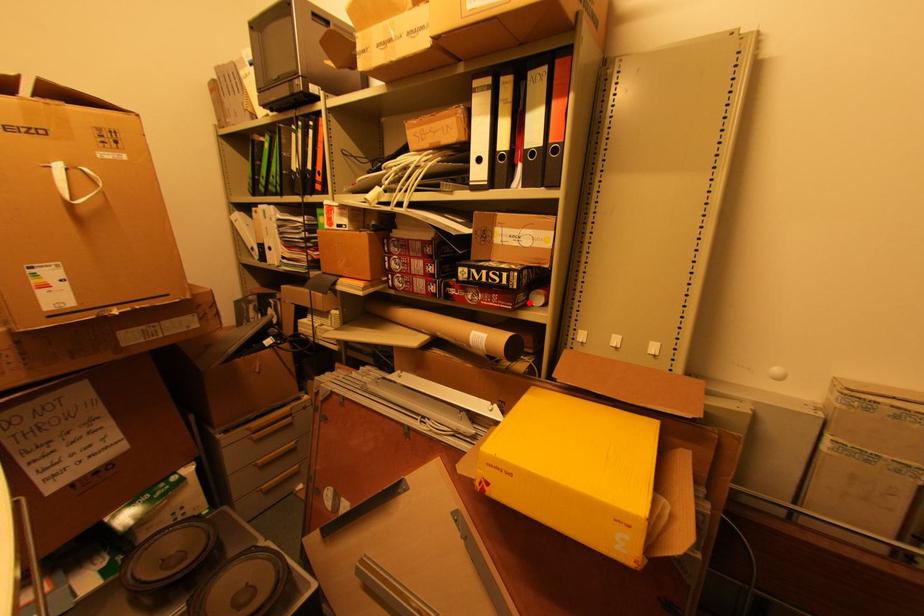
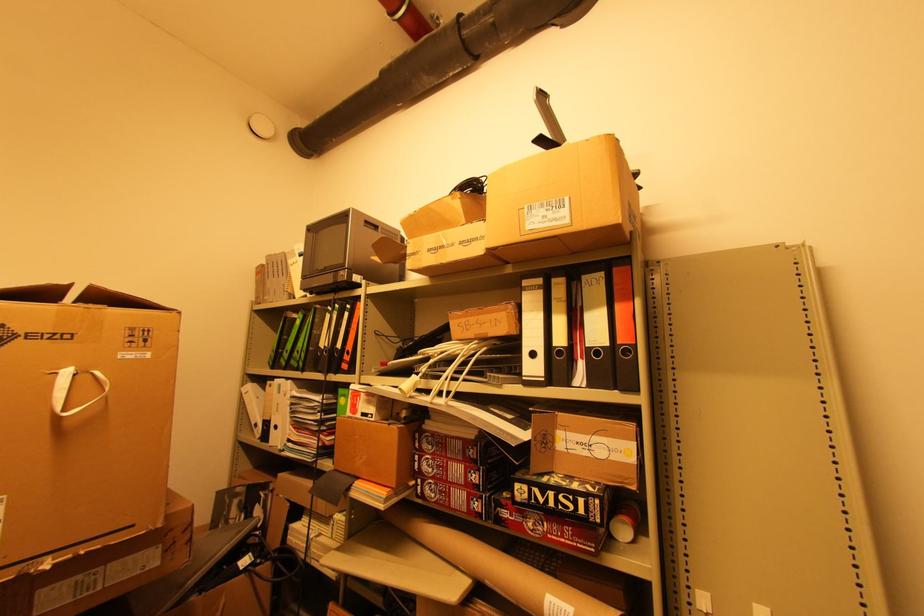
The point at the highlighted location is marked in the first image. Where is the corresponding point in the second image?

(611, 535)